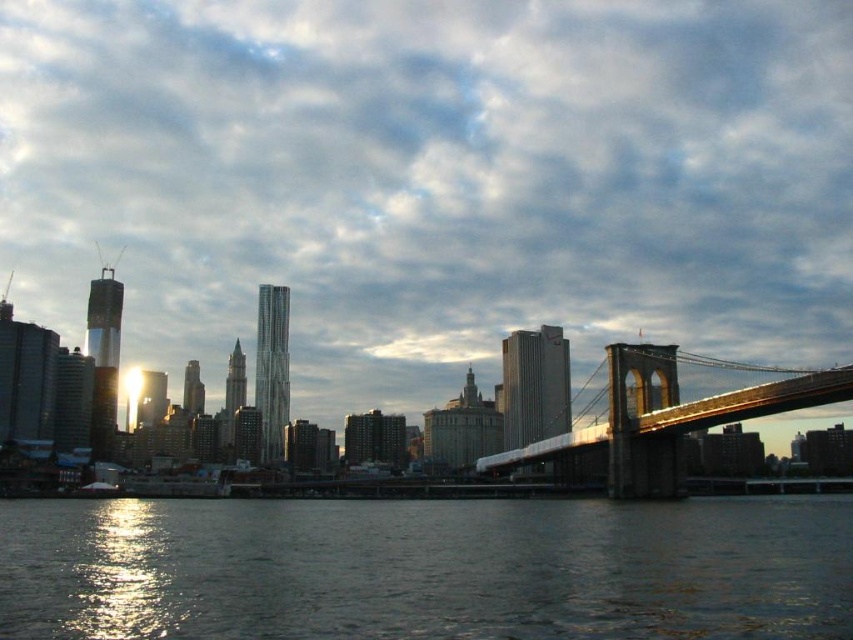
You are an architect designing a new observation deck overlooking the city skyline. You want to ensure visitors can see both the cloudy sky at upper center and the dark water at lower center. Based on their positions, which object will be to the left or right of the other?

The cloudy sky at upper center is positioned on the right side of dark water at lower center, so the cloudy sky at upper center will be to the right of the dark water at lower center.

You are a photographer standing on the riverbank and want to capture both the cloudy sky at upper center and the metallic brown bridge at right in a single frame. Based on their positions, which object should you adjust your camera to focus on first to ensure both are in the shot?

The cloudy sky at upper center is to the left of the metallic brown bridge at right, so you should focus on the metallic brown bridge at right first to ensure both are captured in the frame.